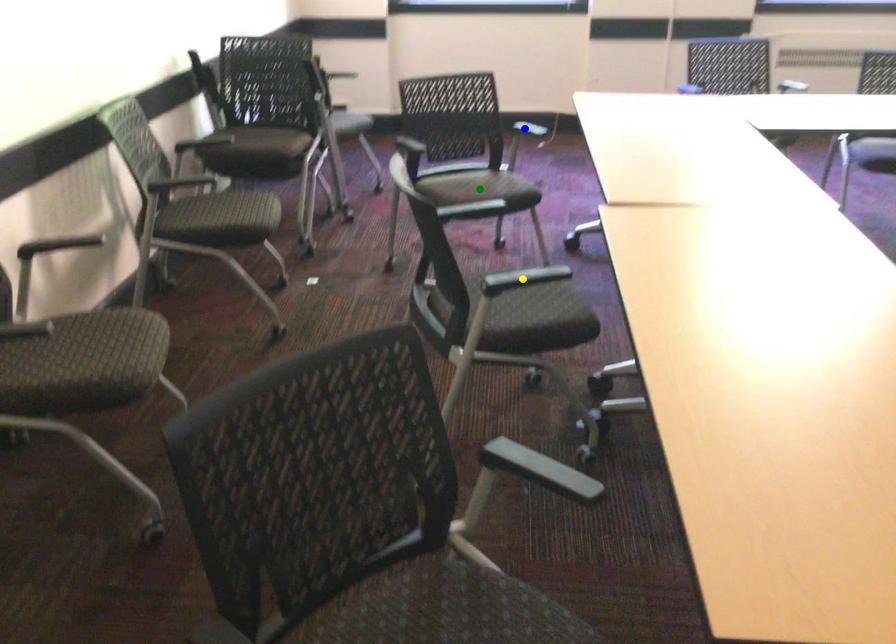
Order these from nearest to farthest:
- blue point
- green point
- yellow point

yellow point → green point → blue point